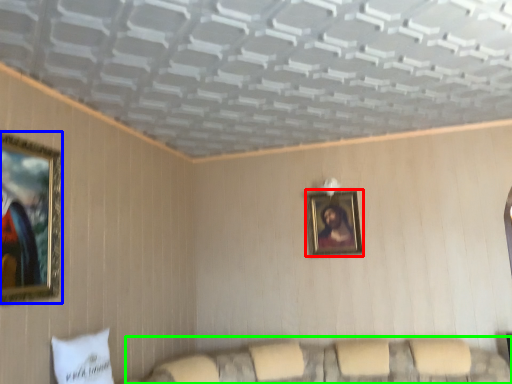
Question: Considering the real-world distances, which object is closest to picture frame (highlighted by a red box)? picture frame (highlighted by a blue box) or couch (highlighted by a green box).

Choices:
 (A) picture frame
 (B) couch

Answer: (B)